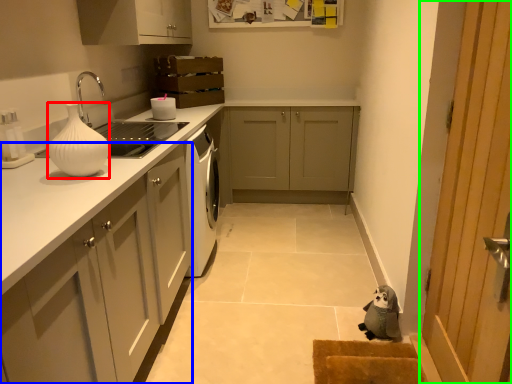
Question: Considering the real-world distances, which object is farthest from vase (highlighted by a red box)? cabinetry (highlighted by a blue box) or door (highlighted by a green box)?

Choices:
 (A) cabinetry
 (B) door

Answer: (B)